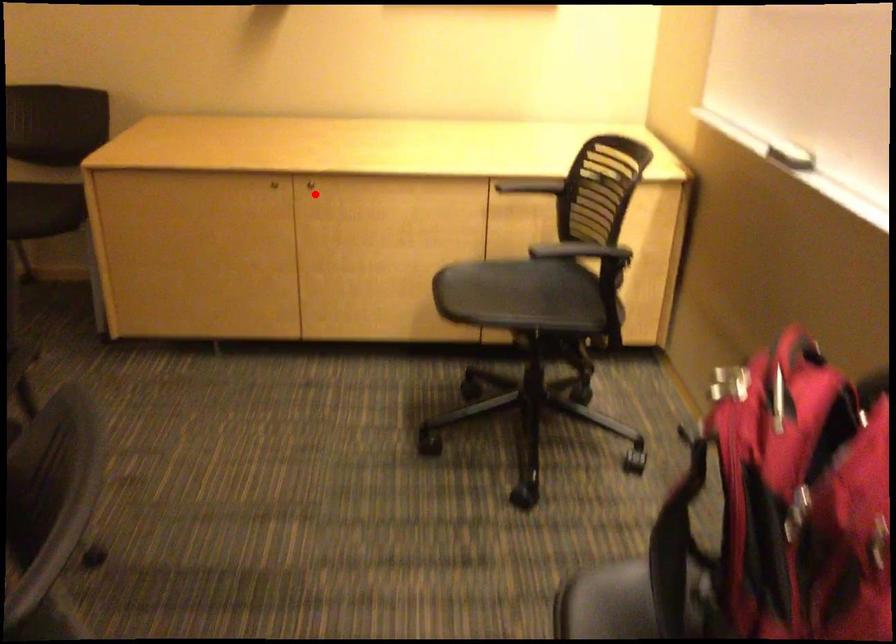
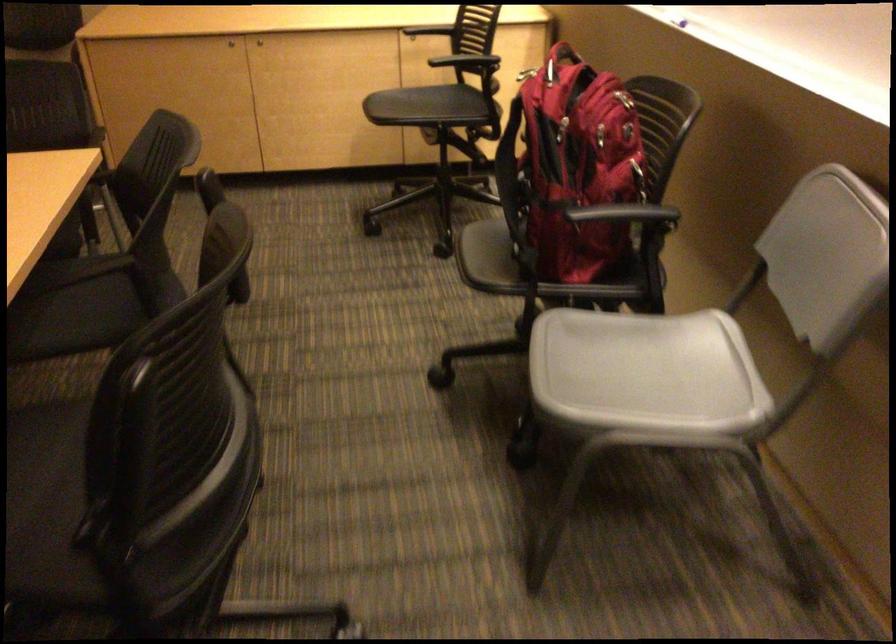
Question: I am providing you with two images of the same scene from different viewpoints. Image1 has a red point marked. In image2, the corresponding 3D location appears at what relative position? Reply with the corresponding letter.

Choices:
 (A) Closer
 (B) Farther

Answer: (B)